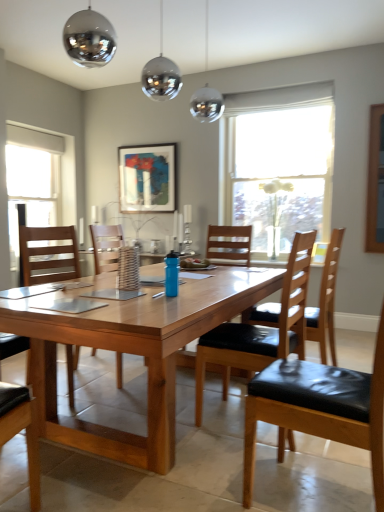
Locate an element on the screen. This screenshot has height=512, width=384. free spot to the right of blue matte water bottle at center is located at coordinates (195, 295).